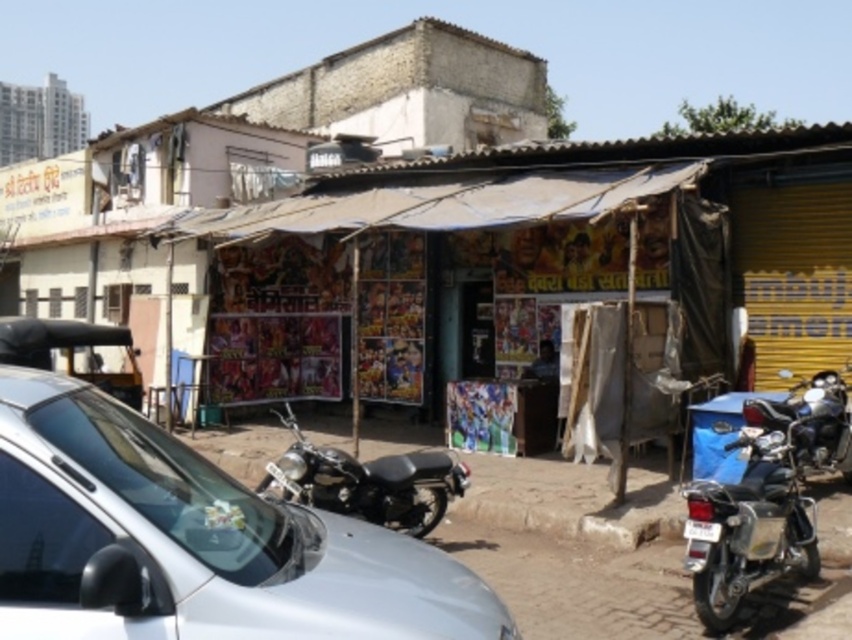
Question: Is shiny black motorcycle at center above shiny chrome motorcycle at right?

Choices:
 (A) no
 (B) yes

Answer: (A)

Question: Which point is closer to the camera?

Choices:
 (A) (749, 518)
 (B) (464, 468)
 (C) (688, 534)
 (D) (304, 628)

Answer: (D)

Question: Which object is positioned closest to the shiny black motorcycle at center?

Choices:
 (A) silver metallic car at center
 (B) shiny metallic motorcycle at lower right
 (C) shiny chrome motorcycle at right
 (D) white plastic license plate at center

Answer: (D)

Question: Does shiny chrome motorcycle at right appear on the right side of white plastic license plate at center?

Choices:
 (A) no
 (B) yes

Answer: (B)

Question: Which of the following is the closest to the observer?

Choices:
 (A) white plastic license plate at center
 (B) shiny metallic motorcycle at lower right
 (C) shiny black motorcycle at center
 (D) shiny chrome motorcycle at right

Answer: (B)

Question: Is silver metallic car at center smaller than shiny chrome motorcycle at right?

Choices:
 (A) yes
 (B) no

Answer: (A)